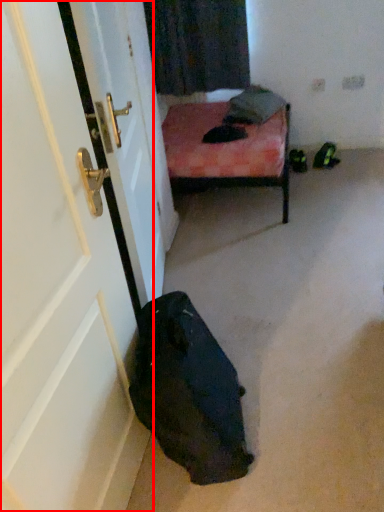
Question: In this image, where is door (annotated by the red box) located relative to pillow?

Choices:
 (A) right
 (B) left

Answer: (B)